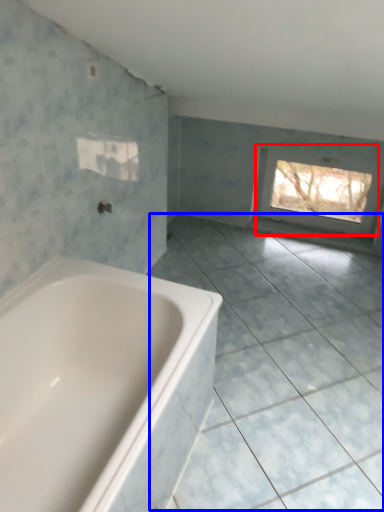
Question: Among these objects, which one is farthest to the camera, window (highlighted by a red box) or ceramic tile (highlighted by a blue box)?

Choices:
 (A) window
 (B) ceramic tile

Answer: (A)